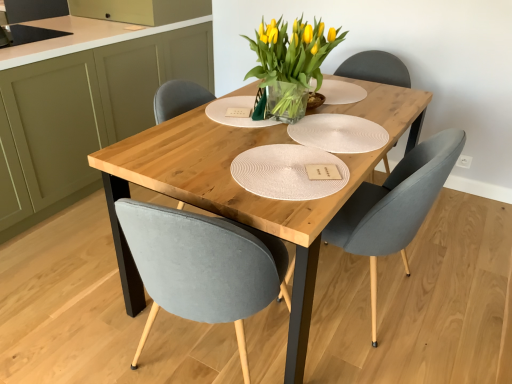
Question: Is velvet grey chair at center completely or partially outside of matte olive green cabinet at left?

Choices:
 (A) no
 (B) yes

Answer: (B)

Question: Is velvet grey chair at center closer to the viewer compared to matte olive green cabinet at left?

Choices:
 (A) no
 (B) yes

Answer: (B)

Question: Are velvet grey chair at center and matte olive green cabinet at left making contact?

Choices:
 (A) no
 (B) yes

Answer: (A)

Question: Is velvet grey chair at center bigger than matte olive green cabinet at left?

Choices:
 (A) yes
 (B) no

Answer: (B)

Question: From the image's perspective, would you say velvet grey chair at center is positioned over matte olive green cabinet at left?

Choices:
 (A) yes
 (B) no

Answer: (B)

Question: In terms of height, does translucent glass vase at center look taller or shorter compared to velvet grey chair at center?

Choices:
 (A) short
 (B) tall

Answer: (A)

Question: Is translucent glass vase at center spatially inside velvet grey chair at center, or outside of it?

Choices:
 (A) inside
 (B) outside

Answer: (B)

Question: From the image's perspective, is translucent glass vase at center above or below velvet grey chair at center?

Choices:
 (A) below
 (B) above

Answer: (B)

Question: Considering the relative positions of translucent glass vase at center and velvet grey chair at center in the image provided, is translucent glass vase at center to the left or to the right of velvet grey chair at center?

Choices:
 (A) right
 (B) left

Answer: (B)

Question: In the image, is matte olive green cabinet at left positioned in front of or behind white textured paper plate at center?

Choices:
 (A) behind
 (B) front

Answer: (A)

Question: Do you think matte olive green cabinet at left is within white textured paper plate at center, or outside of it?

Choices:
 (A) inside
 (B) outside

Answer: (B)

Question: Is matte olive green cabinet at left bigger or smaller than white textured paper plate at center?

Choices:
 (A) small
 (B) big

Answer: (B)

Question: Considering the positions of matte olive green cabinet at left and white textured paper plate at center in the image, is matte olive green cabinet at left wider or thinner than white textured paper plate at center?

Choices:
 (A) wide
 (B) thin

Answer: (A)

Question: From the image's perspective, relative to velvet grey chair at center, is white textured paper plate at center above or below?

Choices:
 (A) below
 (B) above

Answer: (B)

Question: Is white textured paper plate at center wider or thinner than velvet grey chair at center?

Choices:
 (A) wide
 (B) thin

Answer: (B)